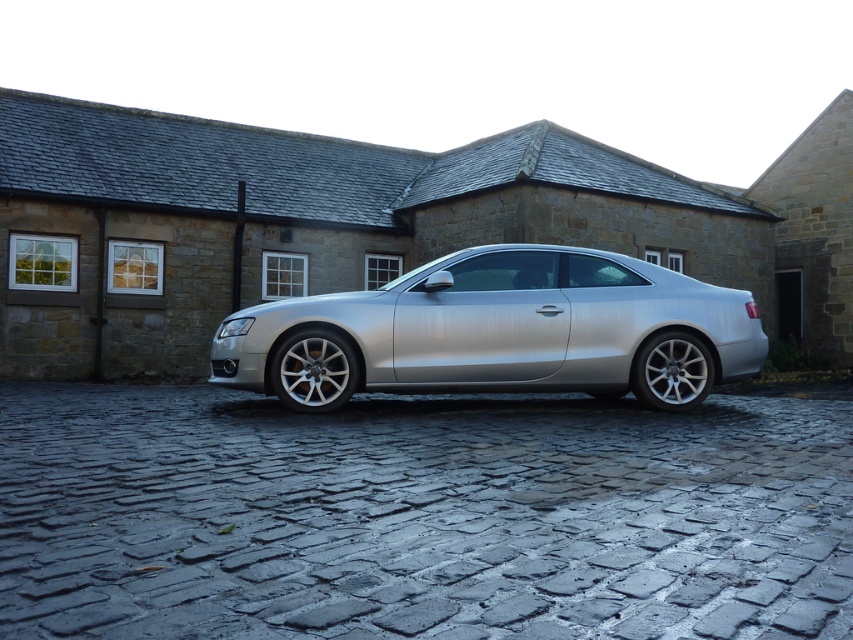
Between dark gray cobblestone driveway at center and silver metallic car at center, which one appears on the left side from the viewer's perspective?

Positioned to the left is dark gray cobblestone driveway at center.

What are the coordinates of `dark gray cobblestone driveway at center` in the screenshot? It's located at (421, 516).

Image resolution: width=853 pixels, height=640 pixels. I want to click on dark gray cobblestone driveway at center, so click(x=421, y=516).